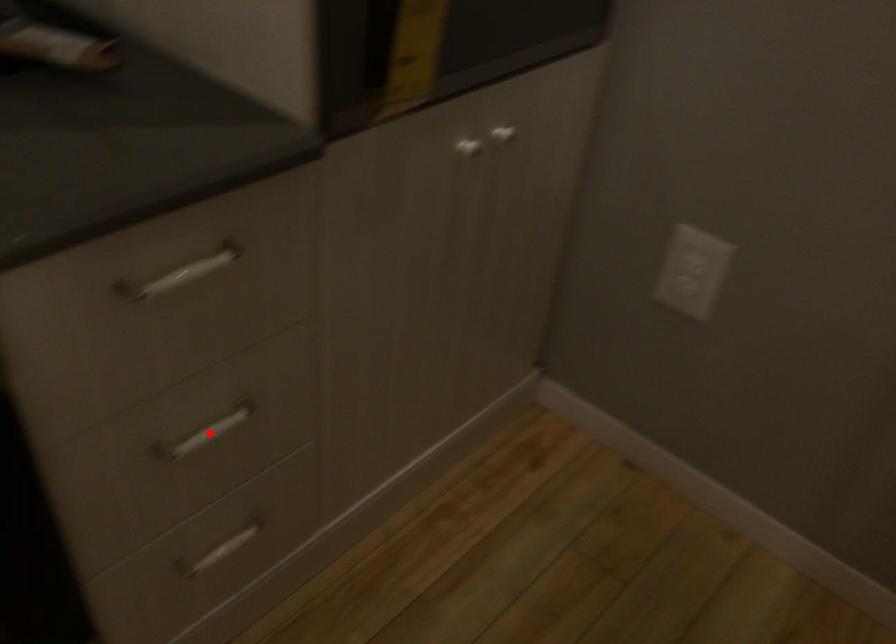
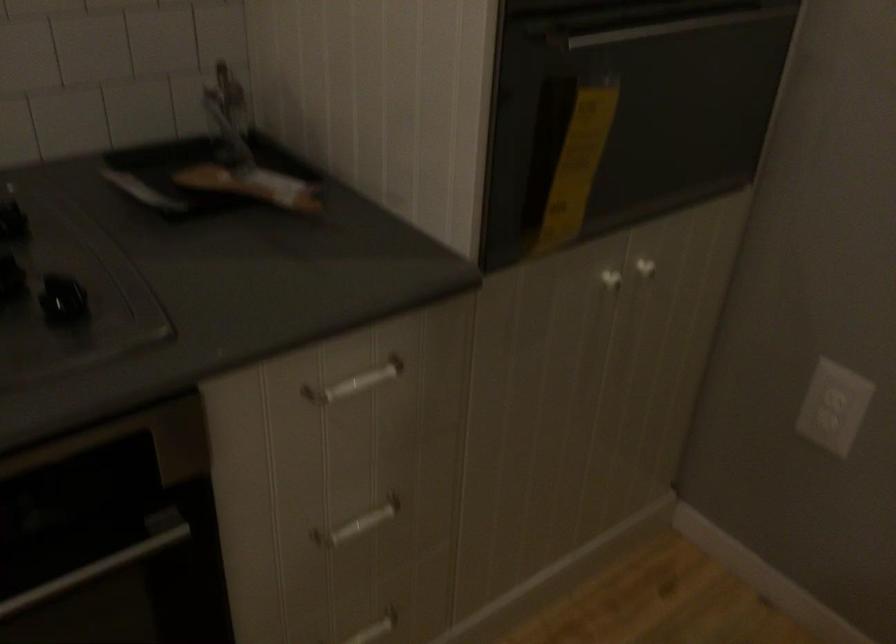
The point at the highlighted location is marked in the first image. Where is the corresponding point in the second image?

(358, 524)